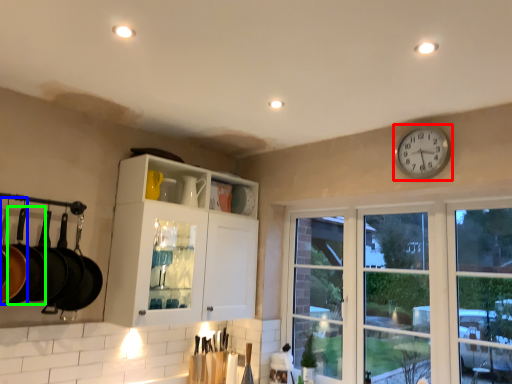
Question: Considering the real-world distances, which object is closest to clock (highlighted by a red box)? frying pan (highlighted by a blue box) or frying pan (highlighted by a green box).

Choices:
 (A) frying pan
 (B) frying pan

Answer: (B)